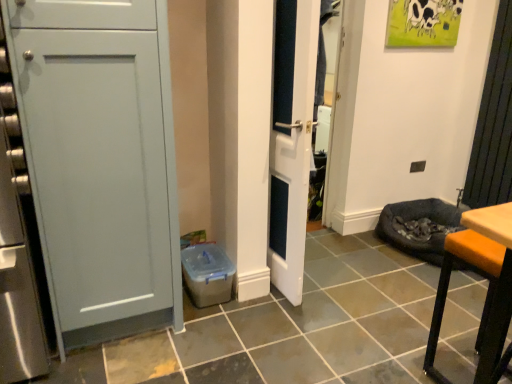
Question: Is orange leather stool at lower right far from white glossy door at center?

Choices:
 (A) no
 (B) yes

Answer: (A)

Question: Does orange leather stool at lower right have a greater width compared to white glossy door at center?

Choices:
 (A) no
 (B) yes

Answer: (B)

Question: Is orange leather stool at lower right placed right next to white glossy door at center?

Choices:
 (A) yes
 (B) no

Answer: (B)

Question: Does orange leather stool at lower right appear on the left side of white glossy door at center?

Choices:
 (A) no
 (B) yes

Answer: (A)

Question: Considering the relative sizes of orange leather stool at lower right and white glossy door at center in the image provided, is orange leather stool at lower right shorter than white glossy door at center?

Choices:
 (A) no
 (B) yes

Answer: (B)

Question: From the image's perspective, is orange leather stool at lower right on top of white glossy door at center?

Choices:
 (A) yes
 (B) no

Answer: (B)

Question: Does white glossy door at center have a greater width compared to orange leather stool at lower right?

Choices:
 (A) no
 (B) yes

Answer: (A)

Question: From a real-world perspective, is white glossy door at center located higher than orange leather stool at lower right?

Choices:
 (A) yes
 (B) no

Answer: (A)

Question: Is white glossy door at center positioned before orange leather stool at lower right?

Choices:
 (A) no
 (B) yes

Answer: (A)

Question: Are white glossy door at center and orange leather stool at lower right far apart?

Choices:
 (A) yes
 (B) no

Answer: (B)

Question: Is white glossy door at center completely or partially outside of orange leather stool at lower right?

Choices:
 (A) no
 (B) yes

Answer: (B)

Question: Is white glossy door at center further to camera compared to orange leather stool at lower right?

Choices:
 (A) yes
 (B) no

Answer: (A)

Question: Is orange leather stool at lower right inside or outside of white glossy door at center?

Choices:
 (A) outside
 (B) inside

Answer: (A)